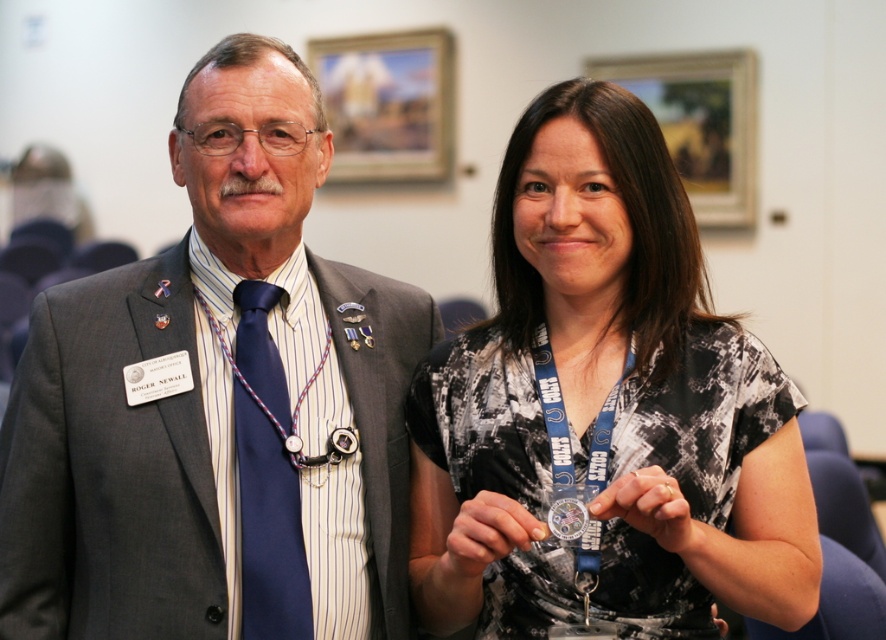
Between point (366, 625) and point (791, 422), which one is positioned in front?

Point (791, 422) is in front.

Can you confirm if matte gray suit at center is taller than printed fabric shirt at center?

Indeed, matte gray suit at center has a greater height compared to printed fabric shirt at center.

Which is behind, point (325, 422) or point (508, 280)?

The point (508, 280) is more distant.

Where is `matte gray suit at center`? matte gray suit at center is located at coordinates (x=216, y=403).